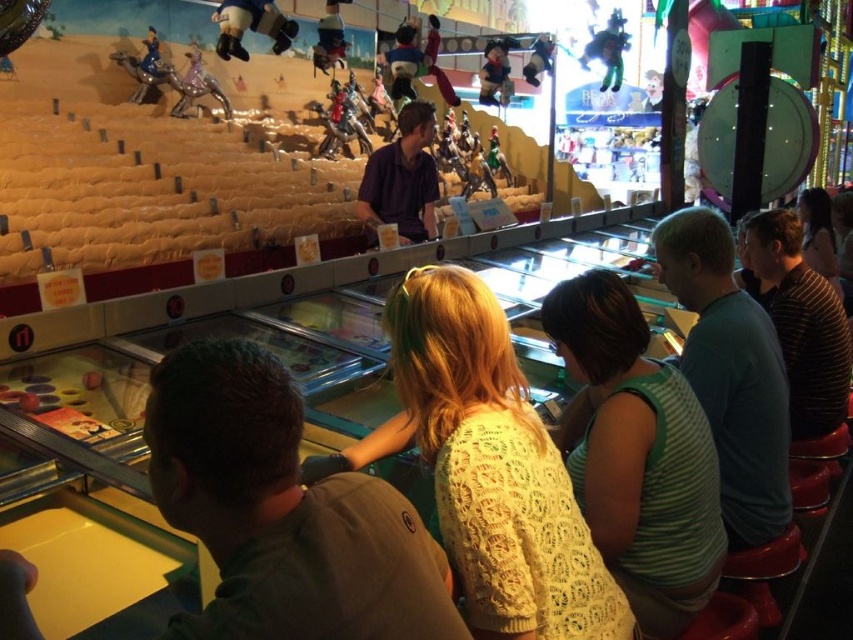
Question: Does light brown sweater at center come in front of green striped tank top at center?

Choices:
 (A) yes
 (B) no

Answer: (A)

Question: Among these objects, which one is nearest to the camera?

Choices:
 (A) green striped tank top at center
 (B) light brown sweater at center
 (C) knitted yellow sweater at center

Answer: (B)

Question: Can you confirm if knitted yellow sweater at center is thinner than striped shirt at right?

Choices:
 (A) yes
 (B) no

Answer: (B)

Question: Which object is the closest to the knitted yellow sweater at center?

Choices:
 (A) green striped shirt at right
 (B) light brown sweater at center
 (C) green striped tank top at center
 (D) striped shirt at right

Answer: (C)

Question: Which of the following is the farthest from the observer?

Choices:
 (A) green striped tank top at center
 (B) striped shirt at right

Answer: (B)

Question: Can you confirm if knitted yellow sweater at center is positioned above purple cotton shirt at center?

Choices:
 (A) yes
 (B) no

Answer: (B)